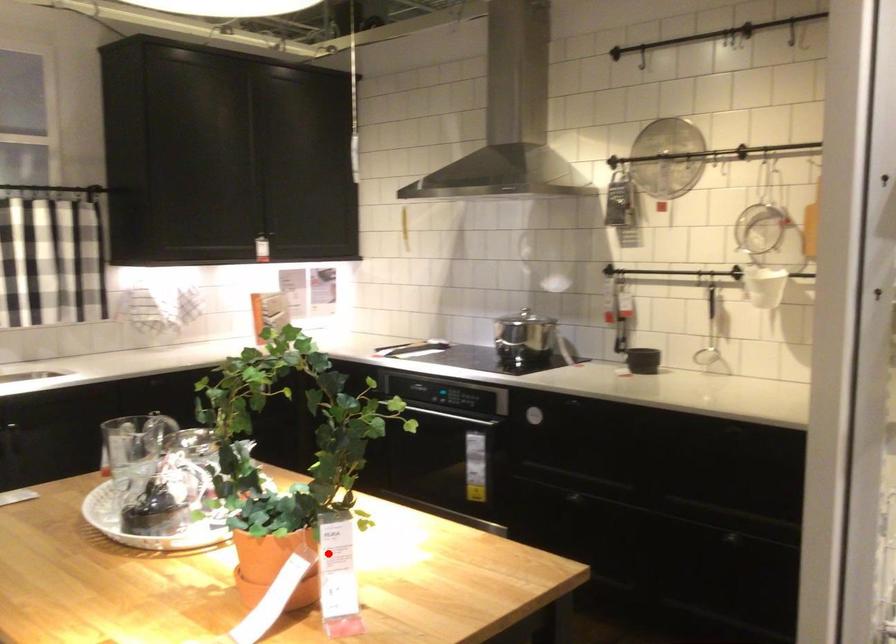
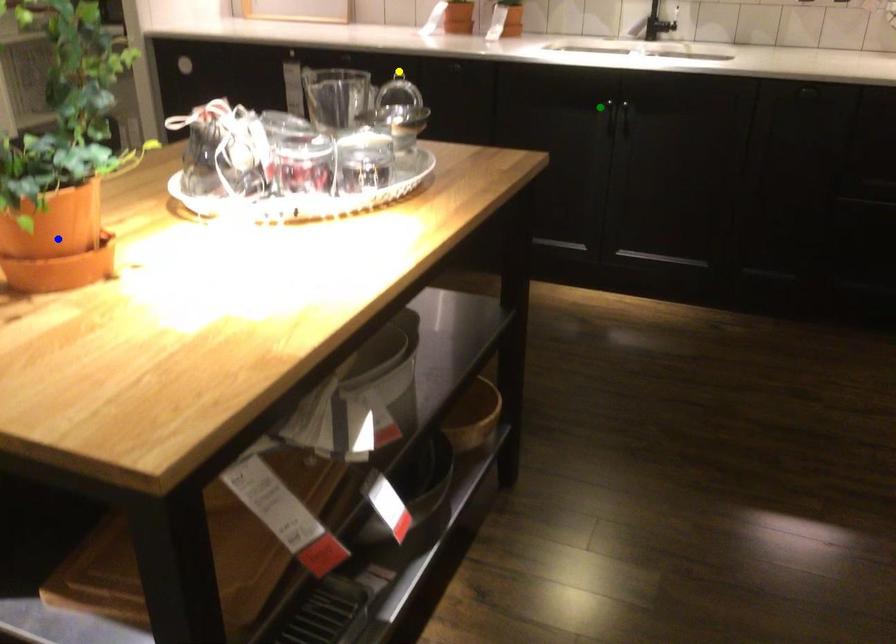
Question: I am providing you with two images of the same scene from different viewpoints. A red point is marked on the first image. You are given multiple points on the second image. Which spot in image 2 lines up with the point in image 1?

Choices:
 (A) blue point
 (B) yellow point
 (C) green point

Answer: (A)